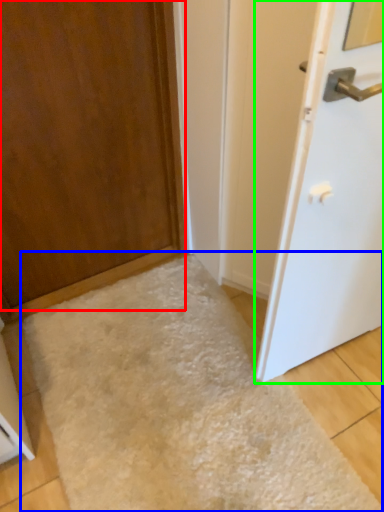
Question: Which object is positioned farthest from door (highlighted by a red box)? Select from flour (highlighted by a blue box) and door (highlighted by a green box).

Choices:
 (A) flour
 (B) door

Answer: (B)